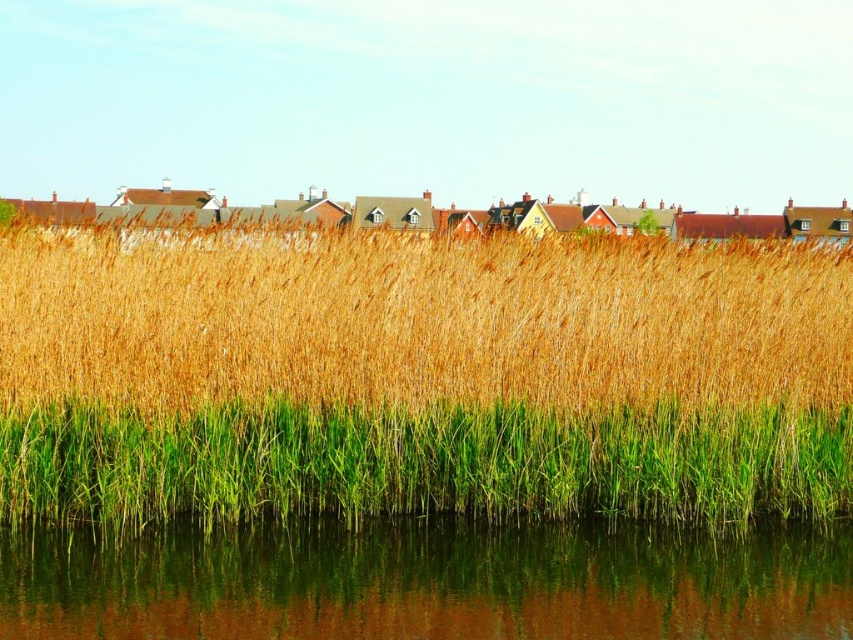
Question: From the image, what is the correct spatial relationship of golden grass at center in relation to green grass at lower center?

Choices:
 (A) above
 (B) below

Answer: (A)

Question: Which object appears farthest from the camera in this image?

Choices:
 (A) golden grass at center
 (B) green grass at lower center
 (C) green reflective water at lower center

Answer: (B)

Question: Based on their relative distances, which object is nearer to the green reflective water at lower center?

Choices:
 (A) green grass at lower center
 (B) golden grass at center

Answer: (A)

Question: Does golden grass at center come in front of green reflective water at lower center?

Choices:
 (A) no
 (B) yes

Answer: (A)

Question: Is golden grass at center to the right of green grass at lower center from the viewer's perspective?

Choices:
 (A) yes
 (B) no

Answer: (B)

Question: Estimate the real-world distances between objects in this image. Which object is farther from the green reflective water at lower center?

Choices:
 (A) green grass at lower center
 (B) golden grass at center

Answer: (B)